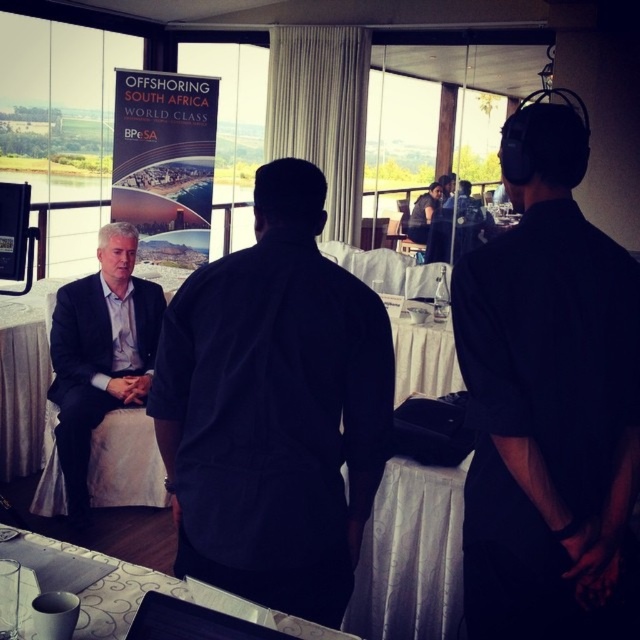
Question: Among these objects, which one is farthest from the camera?

Choices:
 (A) matte black shirt at center
 (B) dark blue shirt at center
 (C) white fabric table at lower center

Answer: (A)

Question: Which object is closer to the camera taking this photo?

Choices:
 (A) white fabric table at lower center
 (B) dark blue shirt at center
 (C) black short-sleeved shirt at center

Answer: (A)

Question: Can you confirm if matte black suit at left is positioned to the left of white fabric table at lower center?

Choices:
 (A) no
 (B) yes

Answer: (B)

Question: Can you confirm if matte black suit at left is positioned above white fabric table at lower center?

Choices:
 (A) yes
 (B) no

Answer: (A)

Question: Which object is the farthest from the black short-sleeved shirt at center?

Choices:
 (A) matte black suit at left
 (B) dark blue shirt at center
 (C) white fabric table at lower center

Answer: (A)

Question: Is black short-sleeved shirt at center positioned behind matte black shirt at center?

Choices:
 (A) yes
 (B) no

Answer: (B)